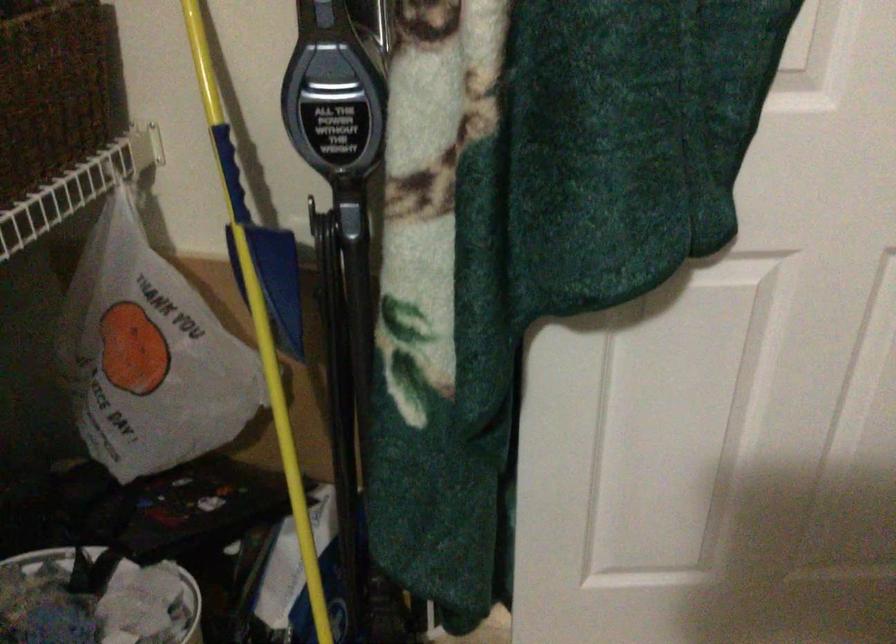
This screenshot has width=896, height=644. What do you see at coordinates (149, 355) in the screenshot?
I see `a plastic shopping bag` at bounding box center [149, 355].